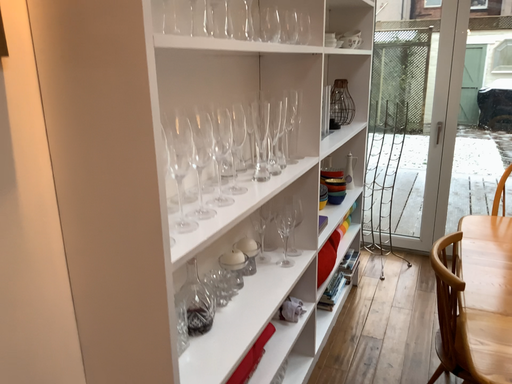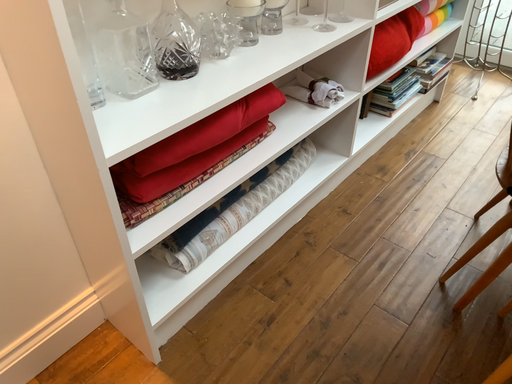
Question: How did the camera likely rotate when shooting the video?

Choices:
 (A) rotated left
 (B) rotated right

Answer: (A)